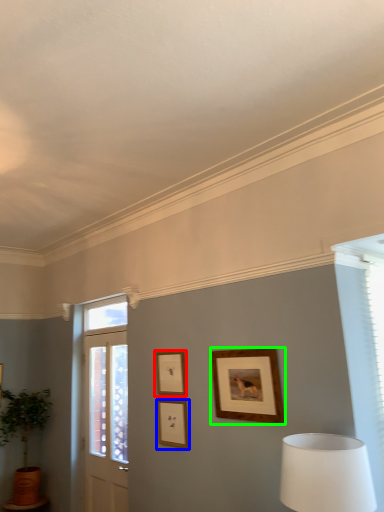
Question: Based on their relative distances, which object is farther from picture frame (highlighted by a red box)? Choose from picture frame (highlighted by a blue box) and picture frame (highlighted by a green box).

Choices:
 (A) picture frame
 (B) picture frame

Answer: (B)